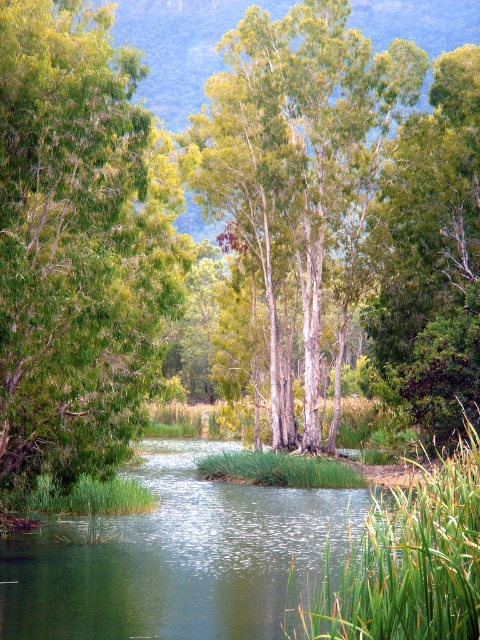
Question: From the image, what is the correct spatial relationship of green leafy tree at left in relation to green leafy tree at upper center?

Choices:
 (A) left
 (B) right

Answer: (A)

Question: Which object is the closest to the green leafy tree at left?

Choices:
 (A) green smooth tree at center
 (B) green leafy tree at upper center

Answer: (A)

Question: Does green leafy tree at left have a lesser width compared to green leafy tree at upper center?

Choices:
 (A) yes
 (B) no

Answer: (A)

Question: Estimate the real-world distances between objects in this image. Which object is closer to the green leafy tree at upper center?

Choices:
 (A) green smooth tree at center
 (B) green leafy tree at left

Answer: (A)

Question: Where is green leafy tree at left located in relation to green smooth tree at center in the image?

Choices:
 (A) below
 (B) above

Answer: (A)

Question: Which of the following is the farthest from the observer?

Choices:
 (A) (197, 176)
 (B) (137, 413)
 (C) (404, 188)

Answer: (A)